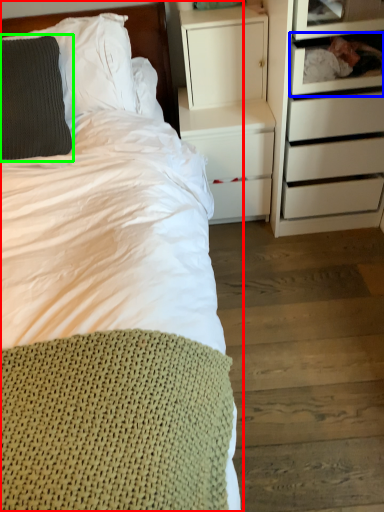
Question: Which object is positioned closest to bed (highlighted by a red box)? Select from shelf (highlighted by a blue box) and pillow (highlighted by a green box).

Choices:
 (A) shelf
 (B) pillow

Answer: (B)